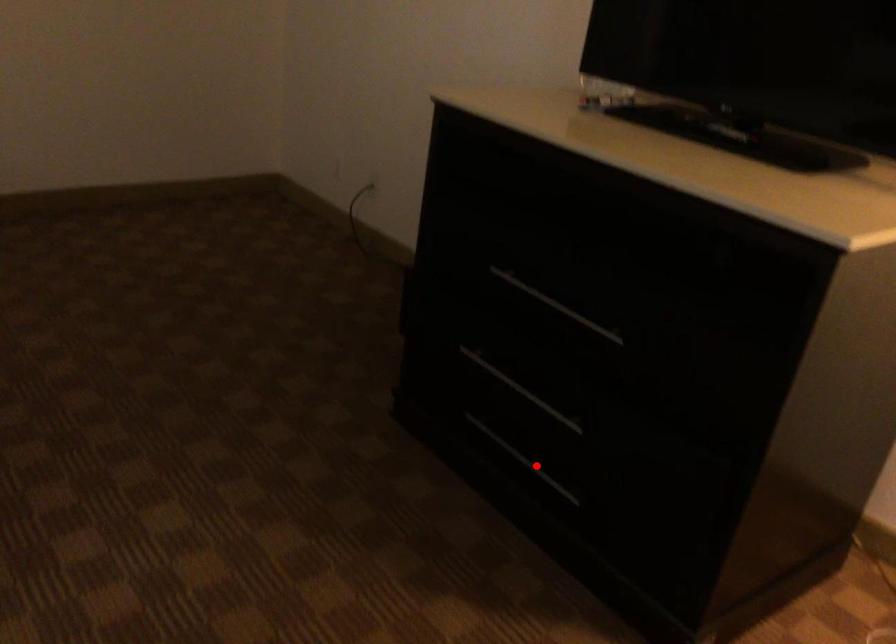
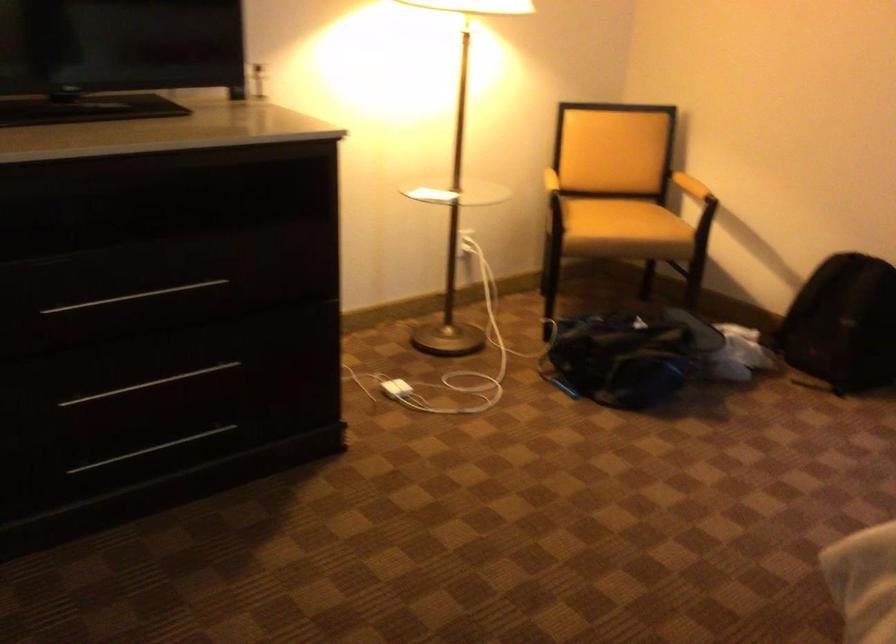
The point at the highlighted location is marked in the first image. Where is the corresponding point in the second image?

(151, 449)